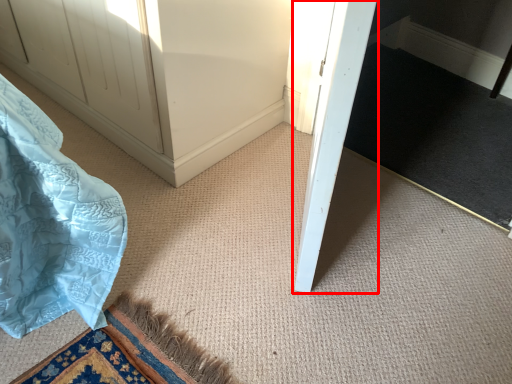
Question: From the image's perspective, where is door (annotated by the red box) located relative to doormat?

Choices:
 (A) below
 (B) above

Answer: (A)